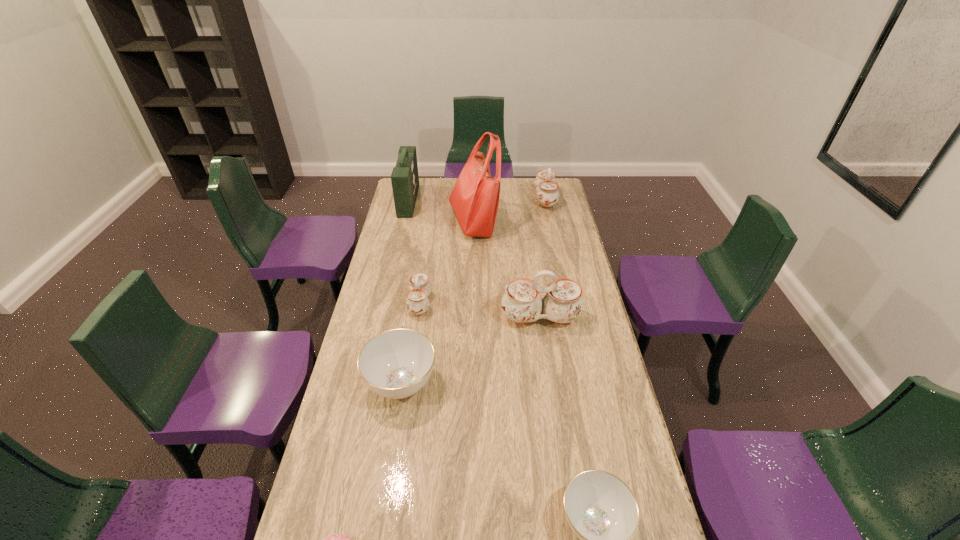
Locate an element on the screen. This screenshot has width=960, height=540. red handbag is located at coordinates (475, 197).

You are a GUI agent. You are given a task and a screenshot of the screen. Output one action in this format:
    pyautogui.click(x=<x>, y=<y>)
    Task: Click on the handbag
    
    Given the screenshot: What is the action you would take?
    coord(475,197)

Locate an element on the screen. This screenshot has height=540, width=960. the first-aid kit is located at coordinates (405, 180).

Locate an element on the screen. The height and width of the screenshot is (540, 960). the third tallest object is located at coordinates (562, 303).

This screenshot has height=540, width=960. I want to click on the tallest chinaware, so click(562, 303).

I want to click on the second tallest chinaware, so click(x=545, y=184).

Find the location of a particular element. the fifth shortest object is located at coordinates (545, 184).

The width and height of the screenshot is (960, 540). I want to click on the leftmost white chinaware, so click(420, 287).

This screenshot has height=540, width=960. Find the location of `the third nearest object`. the third nearest object is located at coordinates [395, 364].

Where is `the left gray chinaware`? Image resolution: width=960 pixels, height=540 pixels. the left gray chinaware is located at coordinates (395, 364).